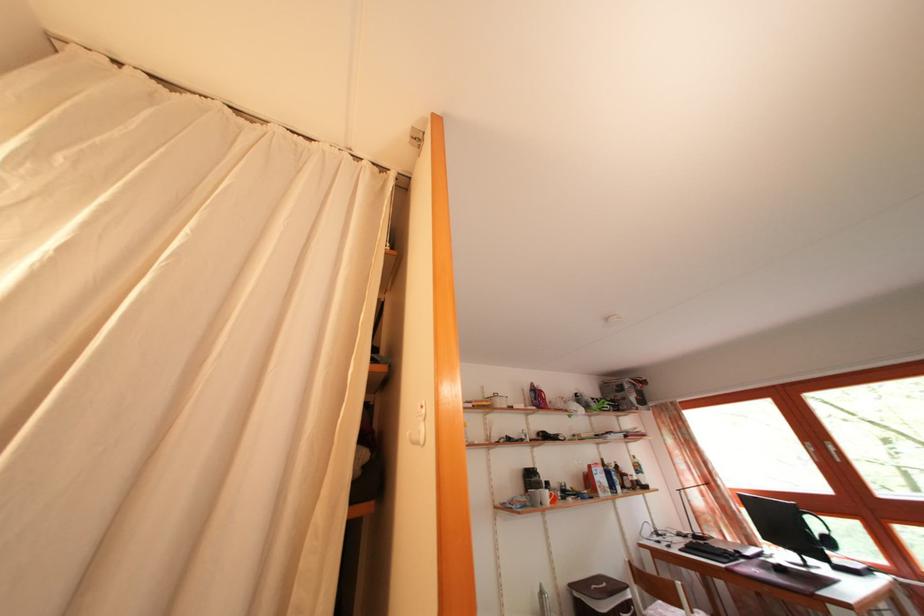
I want to click on chair sitting surface, so click(x=670, y=610).